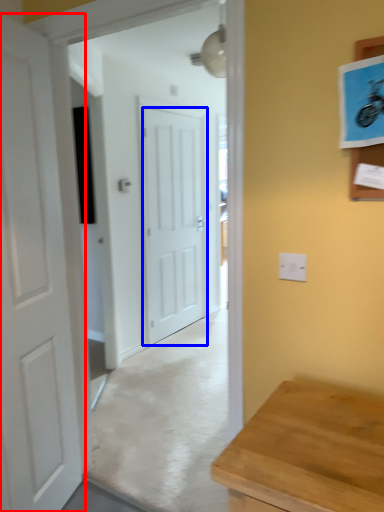
Question: Which object appears farthest to the camera in this image, door (highlighted by a red box) or door (highlighted by a blue box)?

Choices:
 (A) door
 (B) door

Answer: (B)